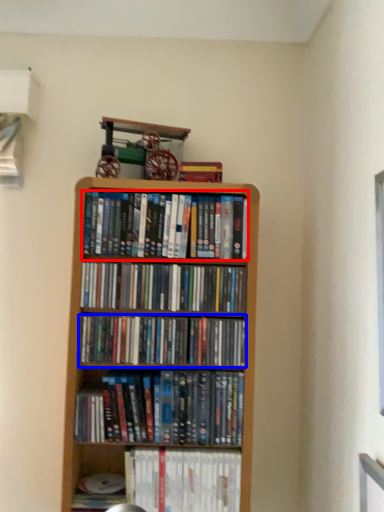
Question: Which point is further to the camera, book (highlighted by a red box) or book (highlighted by a blue box)?

Choices:
 (A) book
 (B) book

Answer: (A)